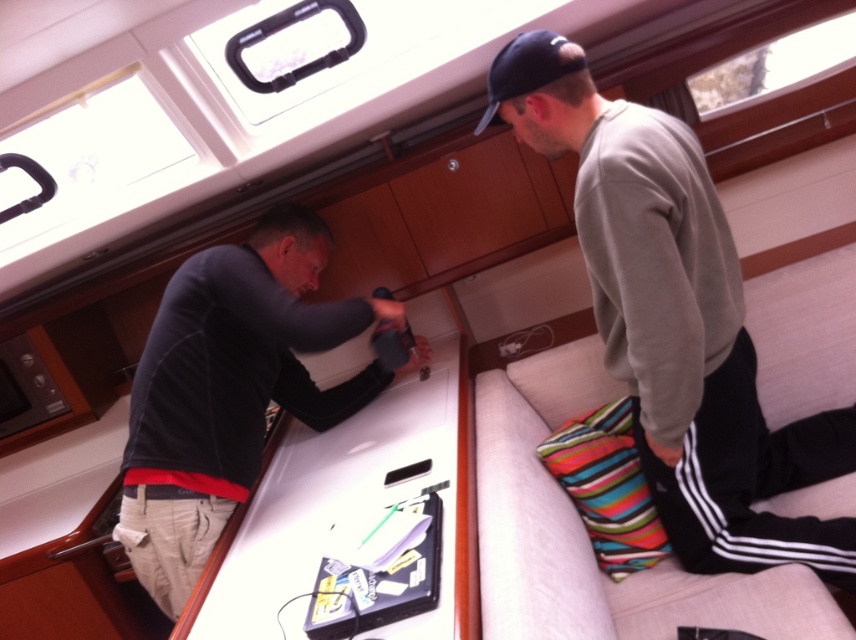
From the picture: Between light gray sweater at upper right and black matte shirt at center, which one appears on the left side from the viewer's perspective?

black matte shirt at center

Between light gray sweater at upper right and black matte shirt at center, which one has more height?

With more height is light gray sweater at upper right.

Which is in front, point (550, 156) or point (299, 308)?

Point (550, 156) is more forward.

You are a GUI agent. You are given a task and a screenshot of the screen. Output one action in this format:
    pyautogui.click(x=<x>, y=<y>)
    Task: Click on the light gray sweater at upper right
    This screenshot has width=856, height=640.
    Given the screenshot: What is the action you would take?
    pyautogui.click(x=676, y=321)